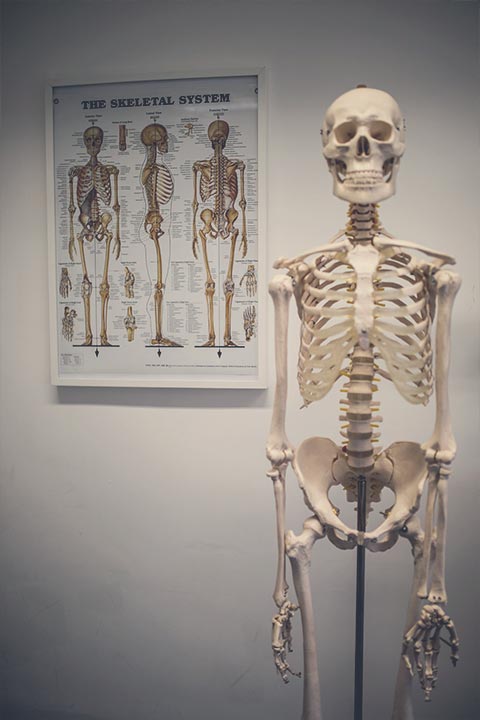
Find the location of a particular element. The width and height of the screenshot is (480, 720). white wall is located at coordinates (304, 204).